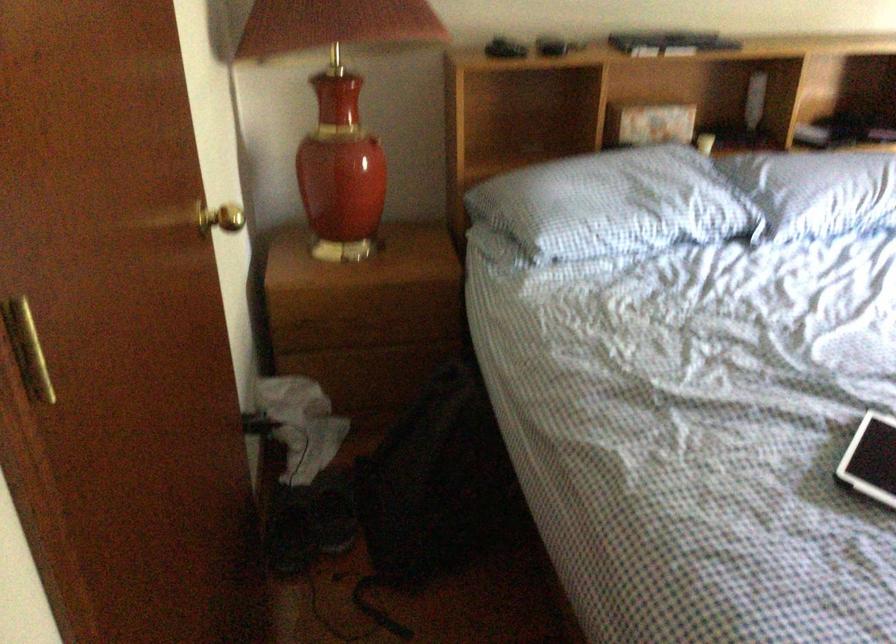
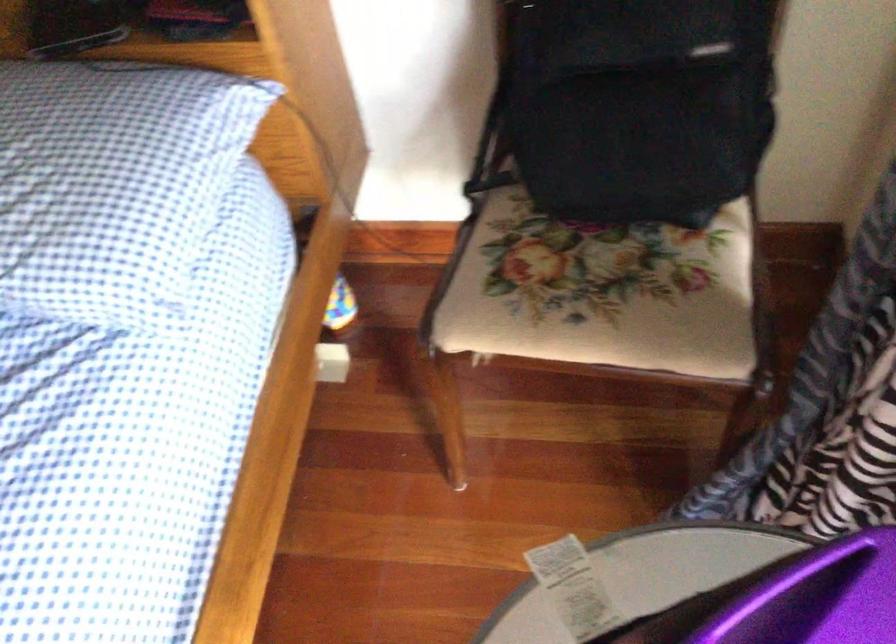
Question: I am providing you with two images of the same scene from different viewpoints. Please identify which objects are invisible in image2.

Choices:
 (A) small white box
 (B) green plastic jug
 (C) small black tablet
 (D) black backpack

Answer: (C)